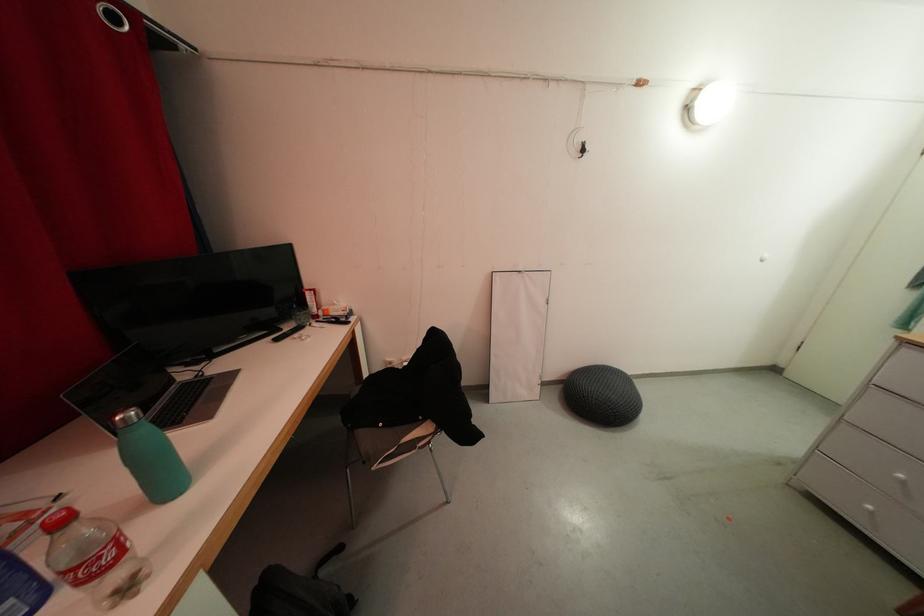
Find the location of a particular element. Image resolution: width=924 pixels, height=616 pixels. chair sitting surface is located at coordinates (407, 410).